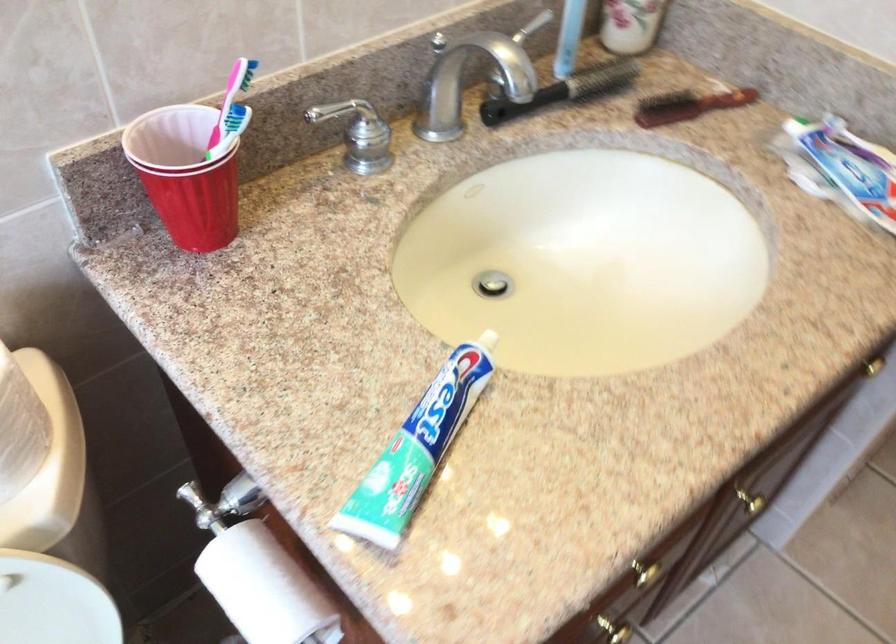
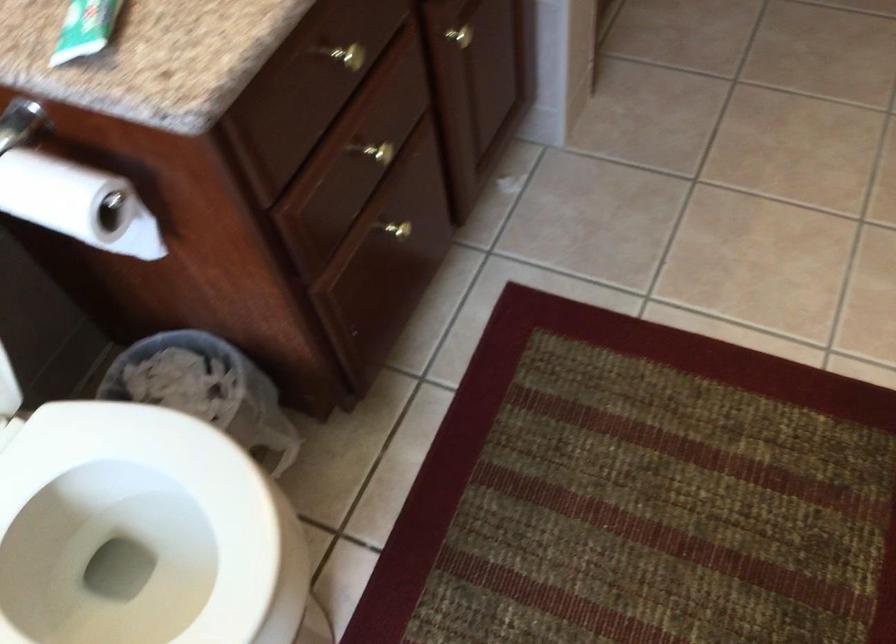
Question: The first image is from the beginning of the video and the second image is from the end. How did the camera likely rotate when shooting the video?

Choices:
 (A) Left
 (B) Right
 (C) Up
 (D) Down

Answer: (D)